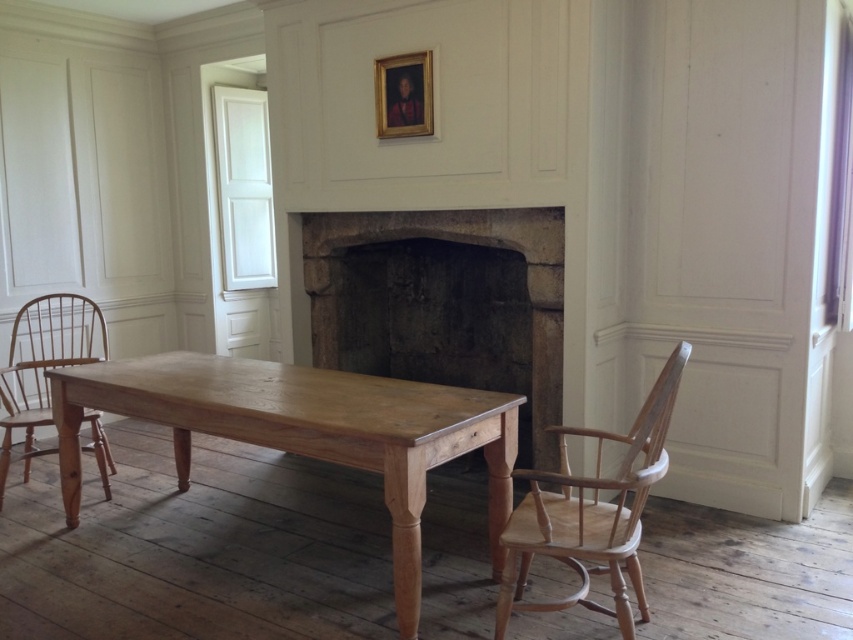
Does natural wood chair at right have a smaller size compared to stone fireplace at center?

Yes.

Between natural wood chair at right and stone fireplace at center, which one has more height?

Standing taller between the two is stone fireplace at center.

Locate an element on the screen. natural wood chair at right is located at coordinates (590, 513).

At what (x,y) coordinates should I click in order to perform the action: click on natural wood chair at right. Please return your answer as a coordinate pair (x, y). Looking at the image, I should click on point(590,513).

Who is positioned more to the left, stone fireplace at center or light brown wood chair at left?

Positioned to the left is light brown wood chair at left.

Consider the image. Which of these two, stone fireplace at center or light brown wood chair at left, stands taller?

stone fireplace at center is taller.

Image resolution: width=853 pixels, height=640 pixels. In order to click on stone fireplace at center in this screenshot , I will do `click(462, 241)`.

Locate an element on the screen. This screenshot has width=853, height=640. stone fireplace at center is located at coordinates (462, 241).

Is light brown wood table at center positioned at the back of stone fireplace at center?

That is False.

Where is `light brown wood table at center`? light brown wood table at center is located at coordinates (306, 433).

The width and height of the screenshot is (853, 640). Describe the element at coordinates (306, 433) in the screenshot. I see `light brown wood table at center` at that location.

Locate an element on the screen. The height and width of the screenshot is (640, 853). light brown wood table at center is located at coordinates (306, 433).